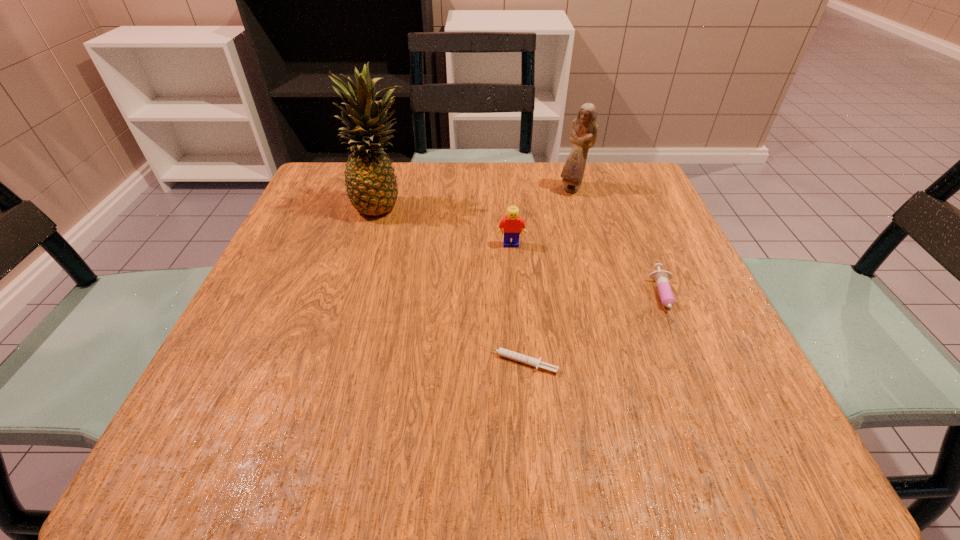
Where is `object at the far left corner`? object at the far left corner is located at coordinates (x=371, y=186).

The height and width of the screenshot is (540, 960). I want to click on object located in the far right corner section of the desktop, so click(x=583, y=134).

Locate an element on the screen. blank area at the far edge is located at coordinates (581, 200).

Locate an element on the screen. vacant region at the near edge of the desktop is located at coordinates (401, 420).

Locate an element on the screen. free space at the left edge is located at coordinates (260, 380).

Where is `free space at the right edge of the desktop`? This screenshot has width=960, height=540. free space at the right edge of the desktop is located at coordinates (662, 253).

This screenshot has width=960, height=540. In the image, there is a desktop. What are the coordinates of `vacant region at the far right corner` in the screenshot? It's located at (629, 204).

Identify the location of vacant space at the near right corner of the desktop. (739, 433).

Where is `free space between the third nearest object and the leftmost object`? free space between the third nearest object and the leftmost object is located at coordinates (447, 225).

The width and height of the screenshot is (960, 540). Find the location of `free area in between the third nearest object and the nearer syringe`. free area in between the third nearest object and the nearer syringe is located at coordinates (515, 303).